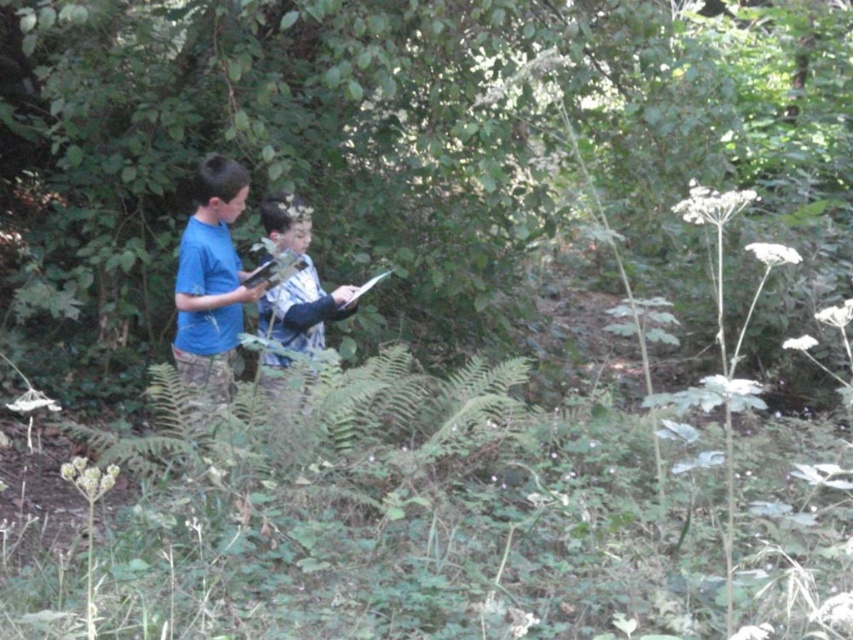
Is blue matte shirt at center to the left of blue fabric shirt at center from the viewer's perspective?

Yes, blue matte shirt at center is to the left of blue fabric shirt at center.

Who is lower down, blue matte shirt at center or blue fabric shirt at center?

blue fabric shirt at center is below.

The image size is (853, 640). Identify the location of blue matte shirt at center. (212, 284).